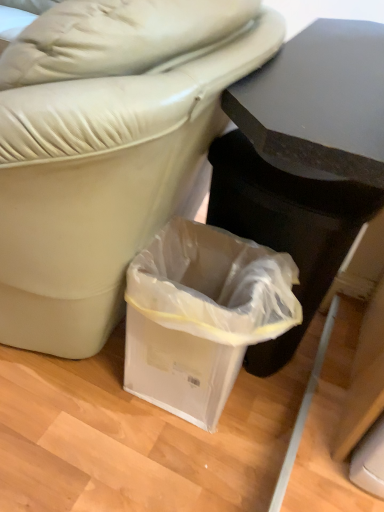
Question: Does black matte table at upper right appear on the left side of translucent plastic bag at lower center?

Choices:
 (A) no
 (B) yes

Answer: (A)

Question: Can you confirm if black matte table at upper right is smaller than translucent plastic bag at lower center?

Choices:
 (A) no
 (B) yes

Answer: (A)

Question: Does black matte table at upper right lie behind translucent plastic bag at lower center?

Choices:
 (A) no
 (B) yes

Answer: (A)

Question: From a real-world perspective, is black matte table at upper right below translucent plastic bag at lower center?

Choices:
 (A) no
 (B) yes

Answer: (A)

Question: Does black matte table at upper right turn towards translucent plastic bag at lower center?

Choices:
 (A) yes
 (B) no

Answer: (A)

Question: Does black matte table at upper right have a lesser height compared to translucent plastic bag at lower center?

Choices:
 (A) no
 (B) yes

Answer: (A)

Question: From a real-world perspective, does translucent plastic bag at lower center stand above black matte table at upper right?

Choices:
 (A) yes
 (B) no

Answer: (B)

Question: From the image's perspective, is translucent plastic bag at lower center under black matte table at upper right?

Choices:
 (A) yes
 (B) no

Answer: (A)

Question: Is translucent plastic bag at lower center positioned in front of black matte table at upper right?

Choices:
 (A) yes
 (B) no

Answer: (B)

Question: Can you confirm if translucent plastic bag at lower center is wider than black matte table at upper right?

Choices:
 (A) yes
 (B) no

Answer: (B)

Question: Is translucent plastic bag at lower center bigger than black matte table at upper right?

Choices:
 (A) yes
 (B) no

Answer: (B)

Question: Is black matte table at upper right inside translucent plastic bag at lower center?

Choices:
 (A) yes
 (B) no

Answer: (B)

Question: In terms of size, does translucent plastic bag at lower center appear bigger or smaller than black matte table at upper right?

Choices:
 (A) small
 (B) big

Answer: (A)